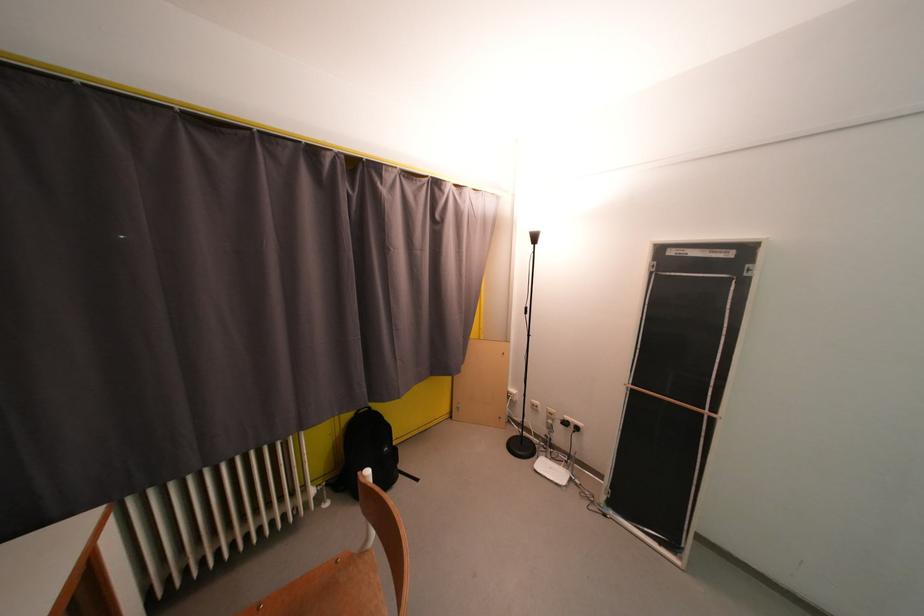
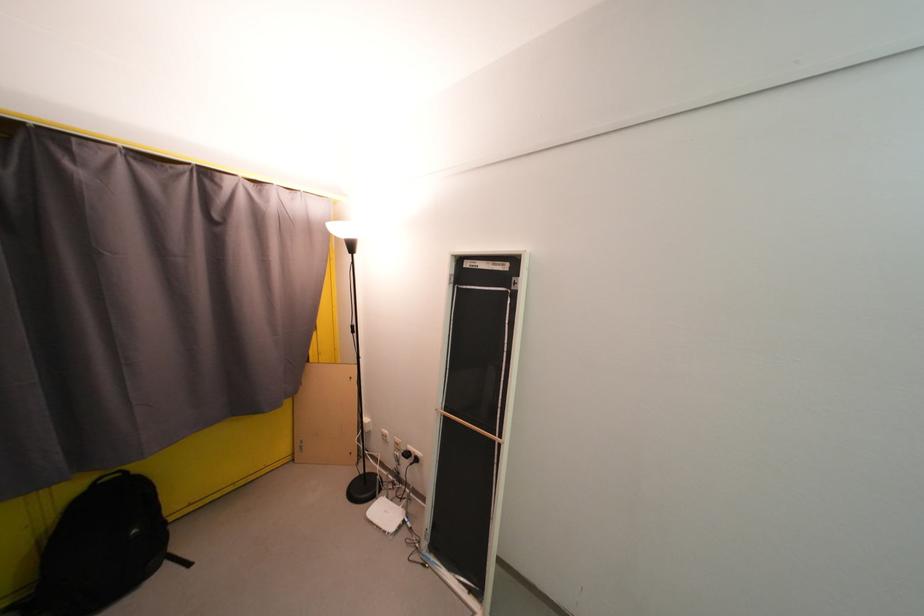
Question: What movement of the cameraman would produce the second image?

Choices:
 (A) Left
 (B) Right
 (C) Forward
 (D) Backward

Answer: (B)